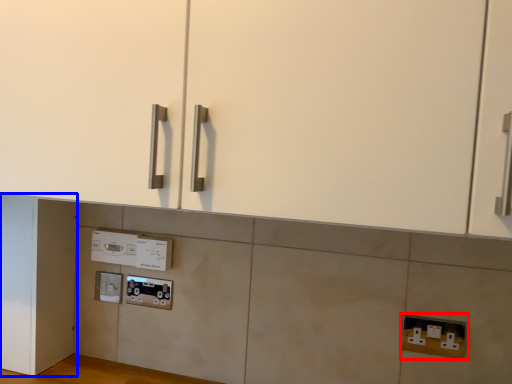
Question: Which of the following is the closest to the observer, electric outlet (highlighted by a red box) or door (highlighted by a blue box)?

Choices:
 (A) electric outlet
 (B) door

Answer: (A)